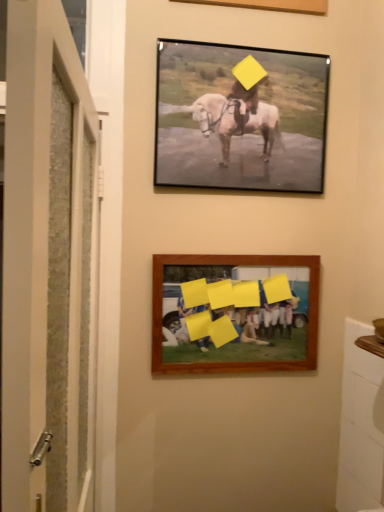
Question: Is white textured door at left at the left side of matte black frame at upper center, the 2th picture frame ordered from the bottom?

Choices:
 (A) yes
 (B) no

Answer: (A)

Question: Are white textured door at left and matte black frame at upper center, which ranks as the first picture frame in top-to-bottom order, beside each other?

Choices:
 (A) no
 (B) yes

Answer: (A)

Question: Is white textured door at left not close to matte black frame at upper center, the 2th picture frame ordered from the bottom?

Choices:
 (A) no
 (B) yes

Answer: (A)

Question: Can you confirm if white textured door at left is thinner than matte black frame at upper center, the 2th picture frame ordered from the bottom?

Choices:
 (A) no
 (B) yes

Answer: (A)

Question: Does white textured door at left have a lesser height compared to matte black frame at upper center, which ranks as the first picture frame in top-to-bottom order?

Choices:
 (A) yes
 (B) no

Answer: (B)

Question: From a real-world perspective, is white textured door at left beneath matte black frame at upper center, which ranks as the first picture frame in top-to-bottom order?

Choices:
 (A) yes
 (B) no

Answer: (A)

Question: From the image's perspective, is white textured door at left on wooden frame at lower center, placed as the 1th picture frame when sorted from bottom to top?

Choices:
 (A) yes
 (B) no

Answer: (B)

Question: Is white textured door at left to the right of wooden frame at lower center, placed as the 1th picture frame when sorted from bottom to top, from the viewer's perspective?

Choices:
 (A) yes
 (B) no

Answer: (B)

Question: Is white textured door at left closer to camera compared to wooden frame at lower center, which appears as the 2th picture frame when viewed from the top?

Choices:
 (A) yes
 (B) no

Answer: (A)

Question: Are white textured door at left and wooden frame at lower center, placed as the 1th picture frame when sorted from bottom to top, far apart?

Choices:
 (A) yes
 (B) no

Answer: (B)

Question: From a real-world perspective, does white textured door at left stand above wooden frame at lower center, which appears as the 2th picture frame when viewed from the top?

Choices:
 (A) yes
 (B) no

Answer: (B)

Question: Can you confirm if white textured door at left is taller than wooden frame at lower center, which appears as the 2th picture frame when viewed from the top?

Choices:
 (A) no
 (B) yes

Answer: (B)

Question: Considering the relative positions of wooden frame at lower center, which appears as the 2th picture frame when viewed from the top, and matte black frame at upper center, the 2th picture frame ordered from the bottom, in the image provided, is wooden frame at lower center, which appears as the 2th picture frame when viewed from the top, to the left of matte black frame at upper center, the 2th picture frame ordered from the bottom, from the viewer's perspective?

Choices:
 (A) yes
 (B) no

Answer: (A)